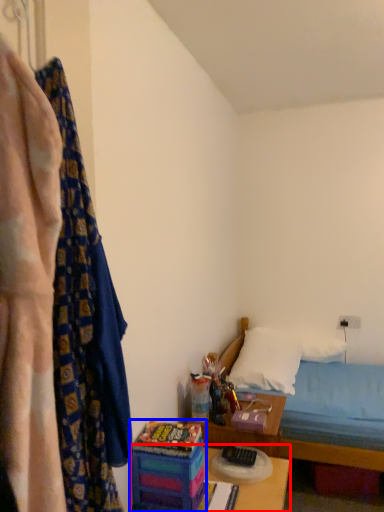
Question: Which object appears closest to the camera in this image, table (highlighted by a red box) or toy (highlighted by a blue box)?

Choices:
 (A) table
 (B) toy

Answer: (A)